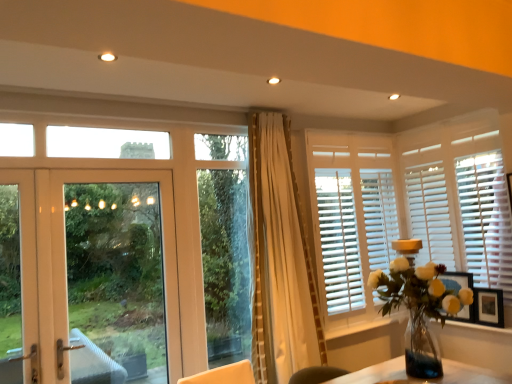
Where is `empty space that is ontop of white wood door at left (from a real-world perspective)`? empty space that is ontop of white wood door at left (from a real-world perspective) is located at coordinates (91, 157).